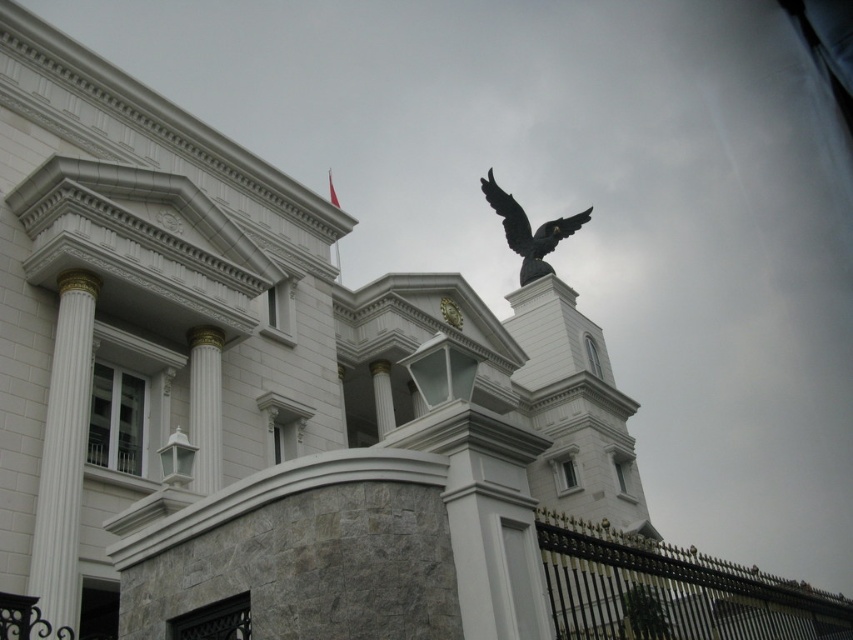
In the scene shown: Does white marble column at left have a greater width compared to shiny black eagle at upper center?

No.

Who is more forward, [73,368] or [531,276]?

Point [73,368]

What do you see at coordinates (64, 452) in the screenshot? I see `white marble column at left` at bounding box center [64, 452].

What are the coordinates of `white marble column at left` in the screenshot? It's located at (64, 452).

Can you confirm if white marble column at center is positioned to the right of shiny black eagle at upper center?

No, white marble column at center is not to the right of shiny black eagle at upper center.

Between point (212, 435) and point (512, 244), which one is positioned in front?

Point (212, 435)

Who is more forward, (213, 353) or (567, 221)?

Positioned in front is point (213, 353).

Identify the location of white marble column at center. Image resolution: width=853 pixels, height=640 pixels. (206, 406).

Which is behind, point (51, 388) or point (213, 461)?

The point (213, 461) is more distant.

Who is more forward, (77, 284) or (207, 397)?

Positioned in front is point (77, 284).

Is point (91, 321) positioned in front of point (209, 464)?

Yes, point (91, 321) is closer to viewer.

The height and width of the screenshot is (640, 853). Find the location of `white marble column at left`. white marble column at left is located at coordinates (64, 452).